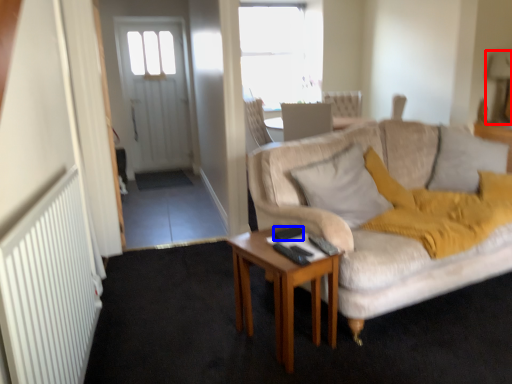
Question: Which of the following is the closest to the observer, lamp (highlighted by a red box) or remote control (highlighted by a blue box)?

Choices:
 (A) lamp
 (B) remote control

Answer: (B)